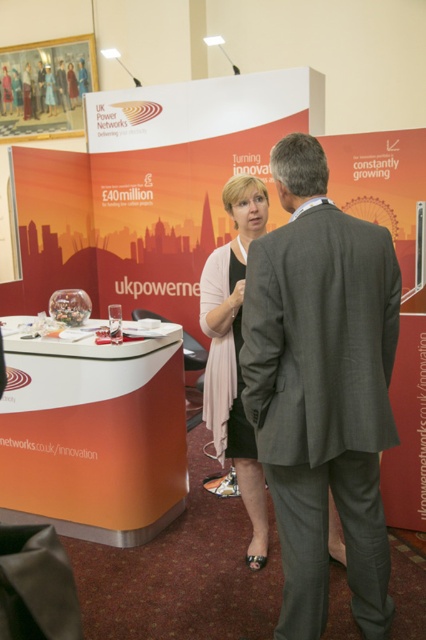
Can you confirm if gray wool suit at center is smaller than pink fabric dress at center?

Incorrect, gray wool suit at center is not smaller in size than pink fabric dress at center.

Locate an element on the screen. gray wool suit at center is located at coordinates (322, 388).

Where is `gray wool suit at center`? The image size is (426, 640). gray wool suit at center is located at coordinates (322, 388).

Find the location of a particular element. gray wool suit at center is located at coordinates (322, 388).